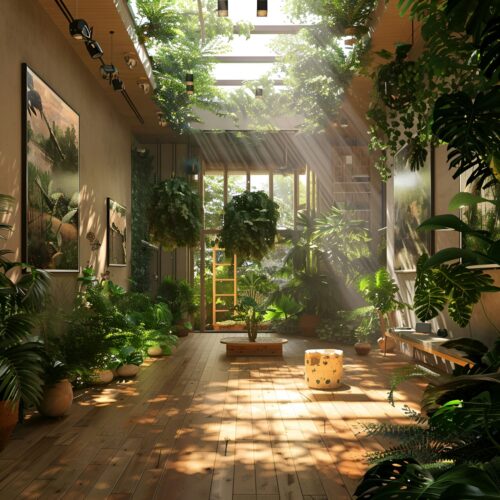
Find the location of a particular element. The width and height of the screenshot is (500, 500). pots is located at coordinates (13, 412), (51, 394), (125, 371), (153, 352), (173, 331), (308, 321), (355, 343), (422, 327).